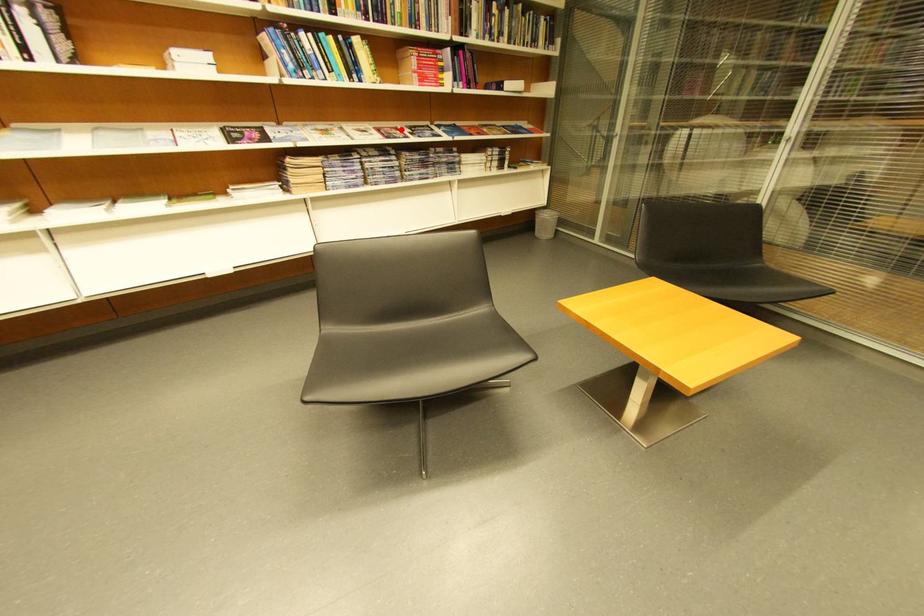
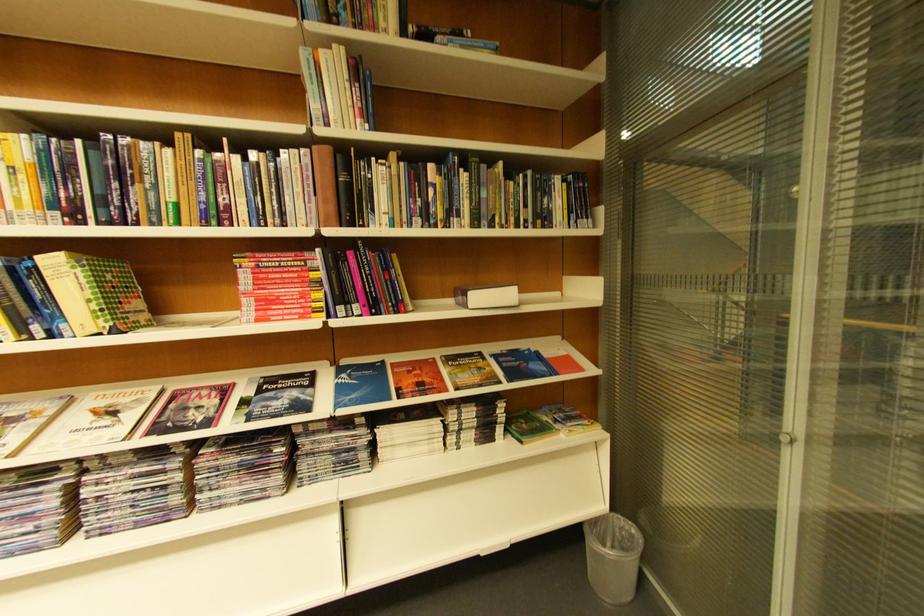
Question: I am providing you with two images of the same scene from different viewpoints. Image1 has a red point marked. In image2, the corresponding 3D location appears at what relative position? Reply with the corresponding letter.

Choices:
 (A) Closer
 (B) Farther

Answer: (B)